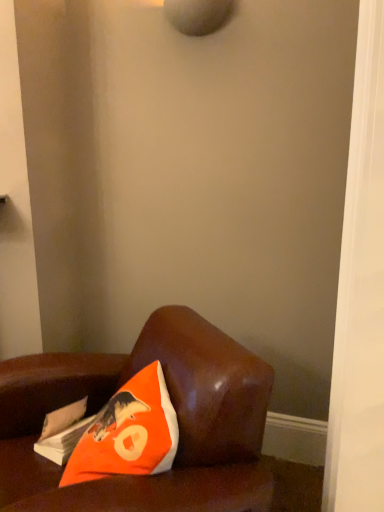
Question: Does point (57, 412) appear closer or farther from the camera than point (122, 468)?

Choices:
 (A) farther
 (B) closer

Answer: (A)

Question: Is white paper magazine at lower left inside the boundaries of orange fabric pillow at lower left, or outside?

Choices:
 (A) outside
 (B) inside

Answer: (A)

Question: Which is nearer to the orange fabric pillow at lower left?

Choices:
 (A) brown leather couch at lower left
 (B) white paper magazine at lower left

Answer: (A)

Question: Considering the real-world distances, which object is closest to the white paper magazine at lower left?

Choices:
 (A) orange fabric pillow at lower left
 (B) brown leather couch at lower left

Answer: (A)